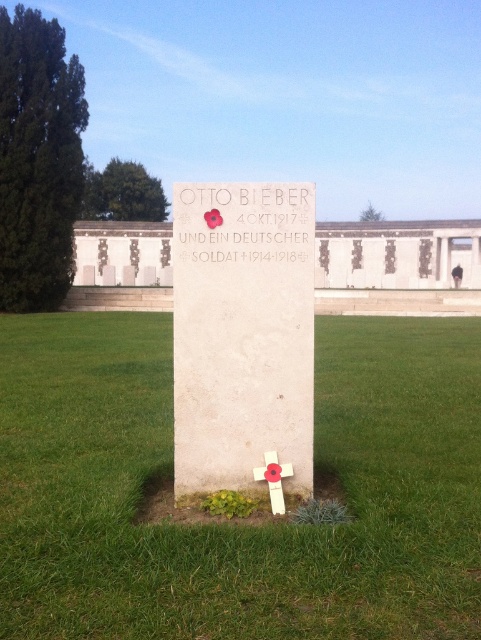
You are a groundskeeper planning to mow the green grass at center and the white marble cross at center. Which object is wider so you can adjust the mower path accordingly?

The green grass at center is wider than the white marble cross at center, so you should adjust the mower path to accommodate its greater width.

You are a visitor at the memorial site and want to place a bouquet of flowers on the green grass at center. However, you notice the white marble cross at center nearby. Which object is taller so that the bouquet won

The white marble cross at center is taller than the green grass at center, so the bouquet will be visible above the green grass at center when placed there.